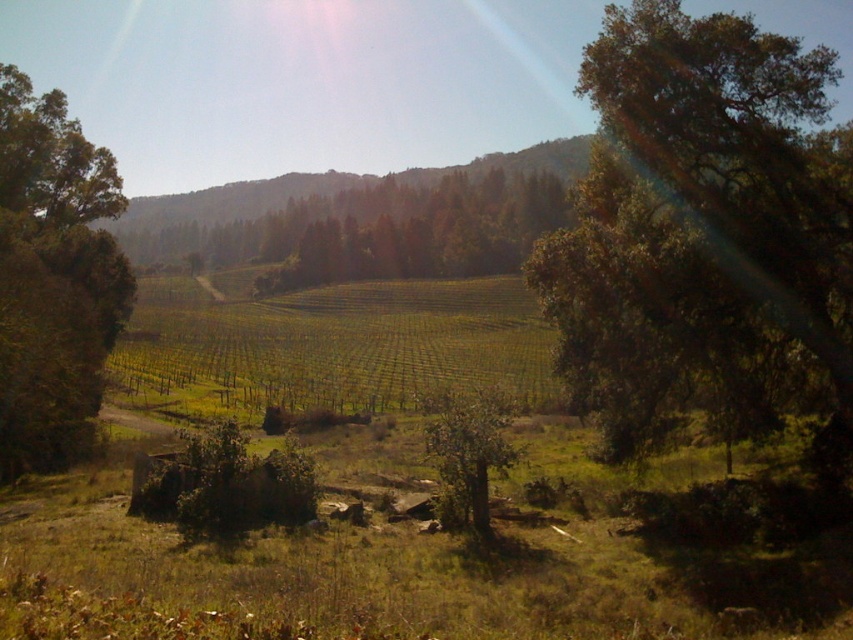
You are an artist planning to paint this rural landscape. You want to emphasize the depth of the scene by placing the green leafy tree at upper right and the green matte tree at center in a way that shows one is closer. Which tree should you paint larger to achieve this effect?

To emphasize depth, you should paint the green leafy tree at upper right larger since it is closer to the viewer than the green matte tree at center, making it appear more prominent in the foreground.

You are standing in the center of the vineyard and want to locate the green leafy tree at left. According to the coordinates provided, in which direction should you look to find it?

The green leafy tree at left is located at coordinates point (53, 276), which means you should look to the left side of the scene to find it.

You are planning to plant a new tree in this rural landscape. You have two options from the image, the green leafy tree at left and the green matte tree at center. Which tree is smaller and better suited for a smaller garden space?

The green leafy tree at left is smaller than the green matte tree at center, making it better suited for a smaller garden space.